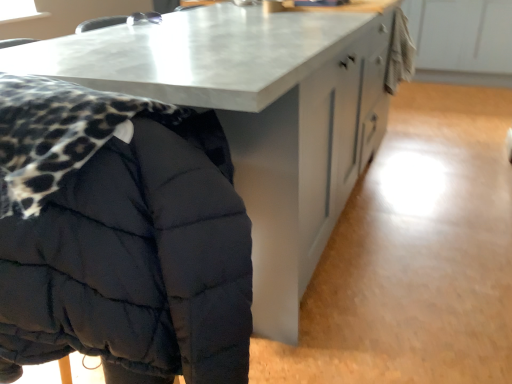
Question: From a real-world perspective, is matte gray table at center beneath quilted black jacket at left?

Choices:
 (A) no
 (B) yes

Answer: (B)

Question: Does matte gray table at center have a smaller size compared to quilted black jacket at left?

Choices:
 (A) yes
 (B) no

Answer: (B)

Question: Is matte gray table at center surrounding quilted black jacket at left?

Choices:
 (A) no
 (B) yes

Answer: (B)

Question: Can you confirm if matte gray table at center is bigger than quilted black jacket at left?

Choices:
 (A) yes
 (B) no

Answer: (A)

Question: Are matte gray table at center and quilted black jacket at left located far from each other?

Choices:
 (A) no
 (B) yes

Answer: (A)

Question: Can you confirm if matte gray table at center is wider than quilted black jacket at left?

Choices:
 (A) yes
 (B) no

Answer: (A)

Question: From a real-world perspective, is quilted black jacket at left located beneath matte gray table at center?

Choices:
 (A) no
 (B) yes

Answer: (A)

Question: From the image's perspective, is quilted black jacket at left on matte gray table at center?

Choices:
 (A) yes
 (B) no

Answer: (B)

Question: Is quilted black jacket at left at the left side of matte gray table at center?

Choices:
 (A) no
 (B) yes

Answer: (B)

Question: Is quilted black jacket at left wider than matte gray table at center?

Choices:
 (A) yes
 (B) no

Answer: (B)

Question: Does quilted black jacket at left have a larger size compared to matte gray table at center?

Choices:
 (A) yes
 (B) no

Answer: (B)

Question: Is matte gray table at center a part of quilted black jacket at left?

Choices:
 (A) no
 (B) yes

Answer: (A)

Question: From the image's perspective, is quilted black jacket at left located above or below matte gray table at center?

Choices:
 (A) above
 (B) below

Answer: (B)